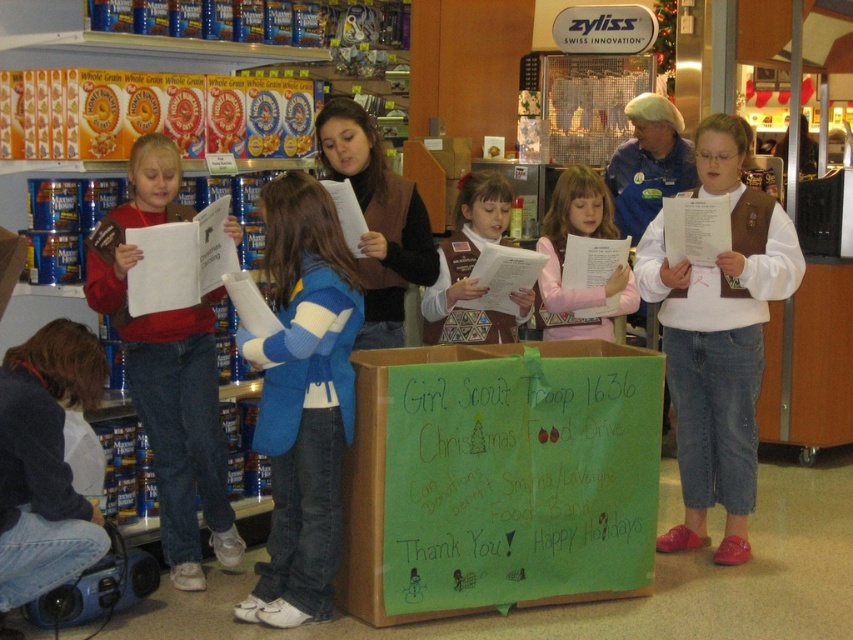
You are a store employee who needs to place a 24 inch wide banner between the blue fleece vest at center and the matte brown vest at left. Can the banner fit between them without overlapping either vest?

The blue fleece vest at center and matte brown vest at left are 25.60 inches apart from each other. Since the banner is 24 inches wide, it can fit between them without overlapping either vest because 24 inches is less than 25.60 inches.

You are a store employee and you need to place a new sign for the Christmas food drive. The current sign is at point (302, 397) on the blue fleece vest at center. Where should you place the new sign so it is not overlapping with the existing one?

Place the new sign away from the blue fleece vest at center where the current sign is located to avoid overlapping.

You are a store employee organizing the Christmas food drive. You see the blue fleece vest at center and the matte brown vest at left. Which vest is smaller in size?

The blue fleece vest at center has a smaller size compared to the matte brown vest at left, so the blue fleece vest at center is smaller.